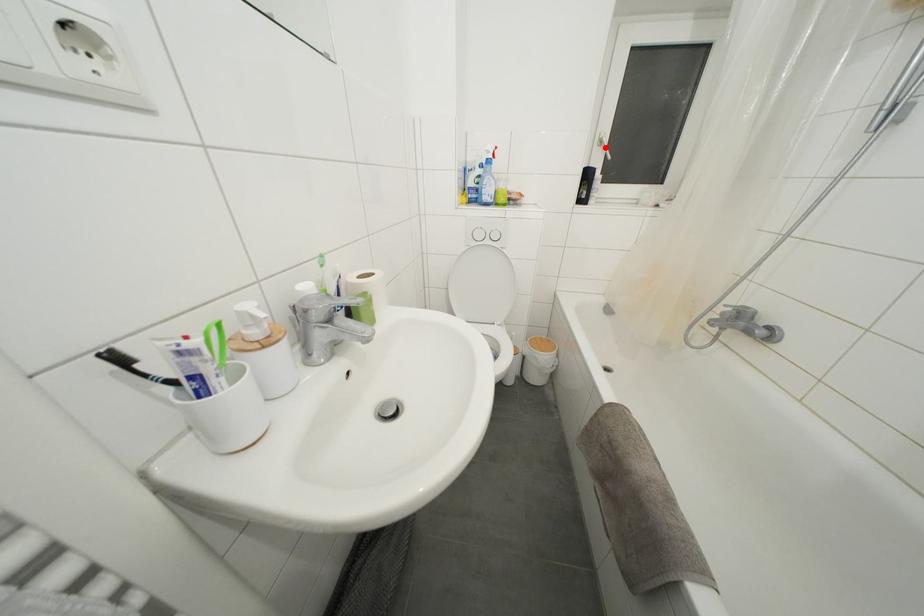
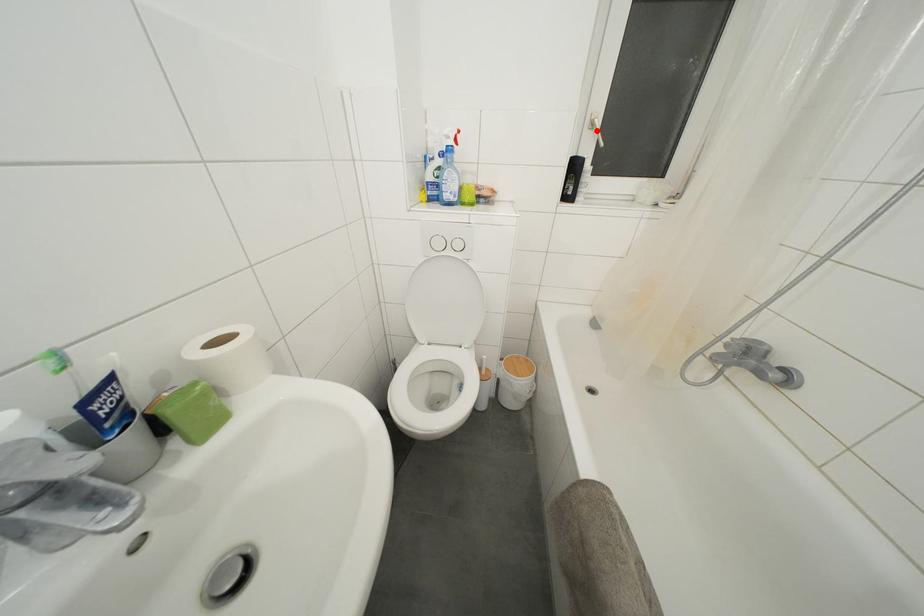
I am providing you with two images of the same scene from different viewpoints. A red point is marked on the first image and another point is marked on the second image. Does the point marked in image1 correspond to the same location as the one in image2?

Yes